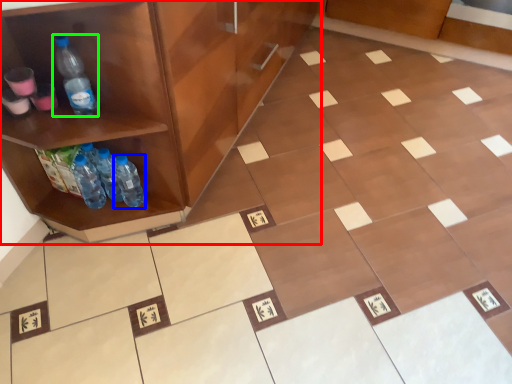
Question: Considering the real-world distances, which object is farthest from cabinetry (highlighted by a red box)? bottle (highlighted by a blue box) or bottle (highlighted by a green box)?

Choices:
 (A) bottle
 (B) bottle

Answer: (A)